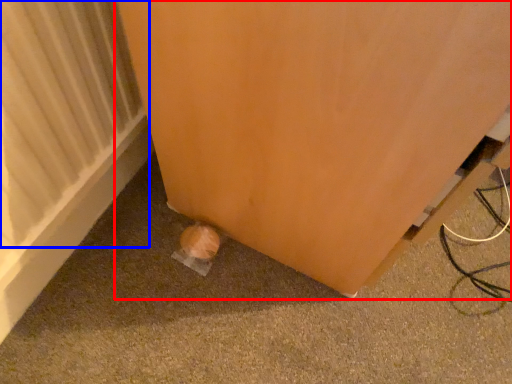
Question: Which point is further to the camera, furniture (highlighted by a red box) or radiator (highlighted by a blue box)?

Choices:
 (A) furniture
 (B) radiator

Answer: (B)